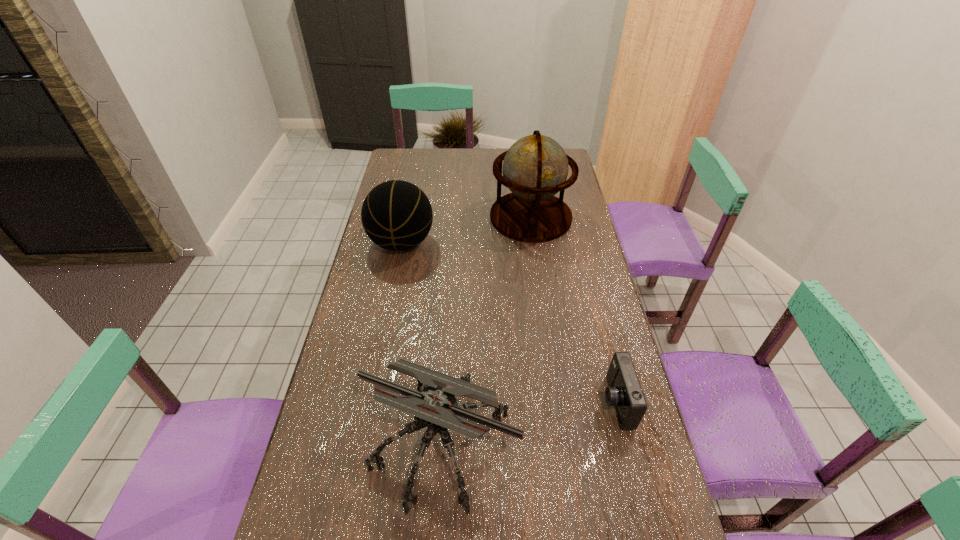
What are the coordinates of `blank region between the globe and the camera` in the screenshot? It's located at (573, 309).

You are a GUI agent. You are given a task and a screenshot of the screen. Output one action in this format:
    pyautogui.click(x=<x>, y=<y>)
    Task: Click on the free space between the basketball and the globe
    This screenshot has height=540, width=960.
    Given the screenshot: What is the action you would take?
    pyautogui.click(x=467, y=230)

Locate an element on the screen. This screenshot has width=960, height=540. free space between the shortest object and the drone is located at coordinates (528, 421).

Locate an element on the screen. This screenshot has height=540, width=960. free space between the drone and the basketball is located at coordinates (421, 342).

Find the location of a particular element. This screenshot has height=540, width=960. free point between the drone and the basketball is located at coordinates (421, 342).

Where is `free space between the basketball and the drone`? The width and height of the screenshot is (960, 540). free space between the basketball and the drone is located at coordinates (421, 342).

Locate an element on the screen. This screenshot has height=540, width=960. object identified as the second closest to the shortest object is located at coordinates (535, 168).

Locate an element on the screen. object identified as the closest to the basketball is located at coordinates (535, 168).